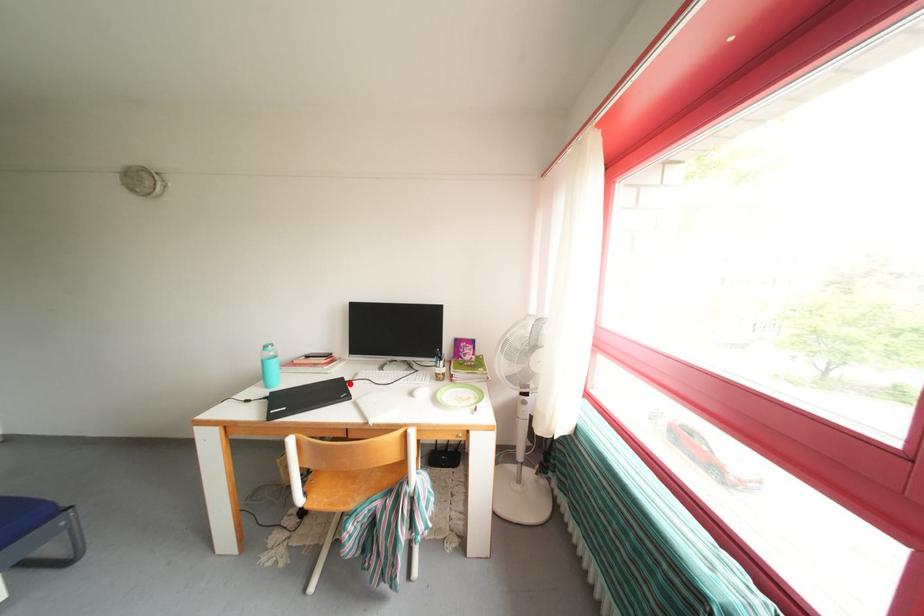
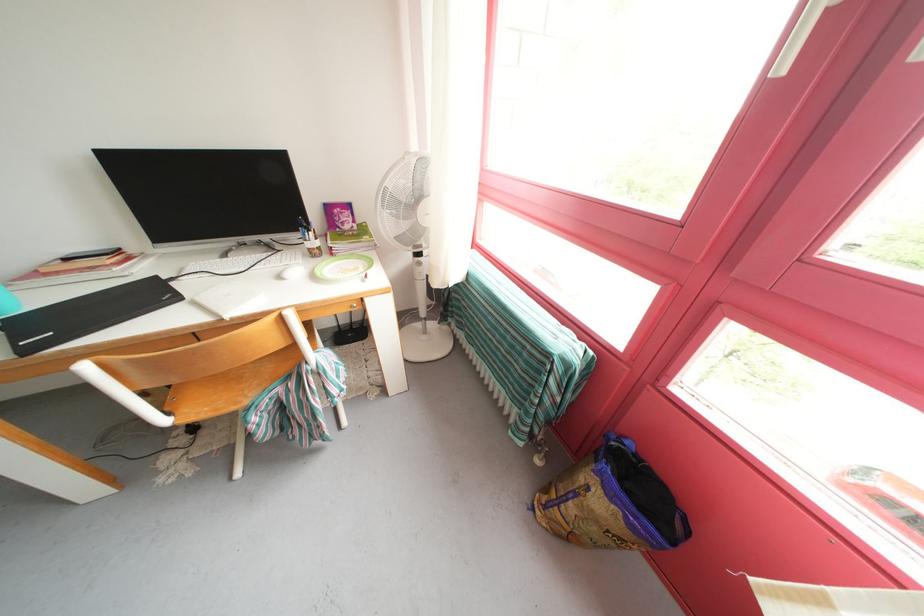
The point at the highlighted location is marked in the first image. Where is the corresponding point in the second image?

(164, 283)